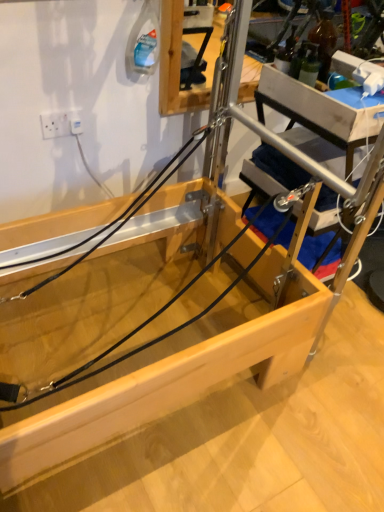
Find the location of `free spot above transparent plastic at center (from a real-world perspective)`. free spot above transparent plastic at center (from a real-world perspective) is located at coordinates (225, 378).